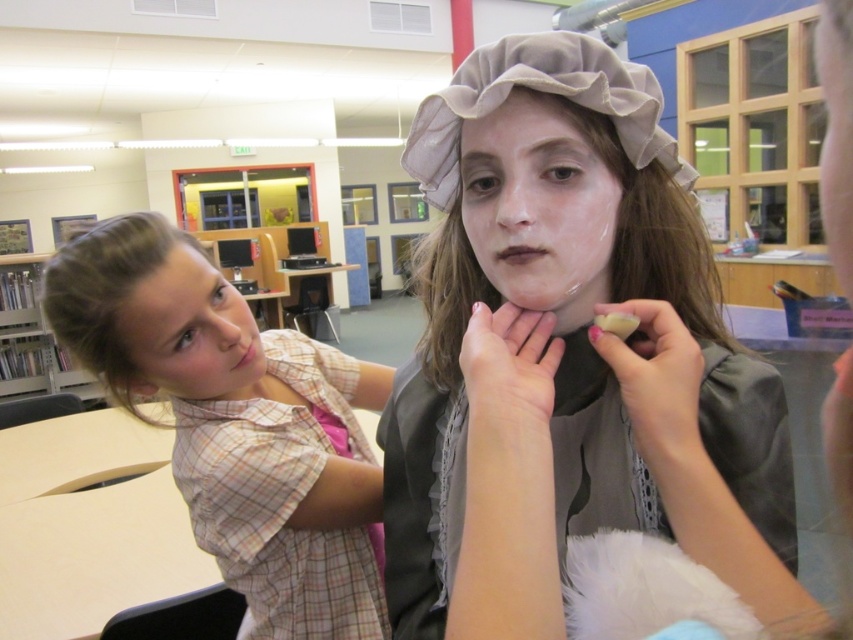
Between matte gray fabric hat at center and wooden bookshelf at left, which one appears on the left side from the viewer's perspective?

From the viewer's perspective, wooden bookshelf at left appears more on the left side.

Can you confirm if matte gray fabric hat at center is wider than wooden bookshelf at left?

In fact, matte gray fabric hat at center might be narrower than wooden bookshelf at left.

Who is more distant from viewer, (x=653, y=195) or (x=68, y=360)?

Point (x=68, y=360)

Locate an element on the screen. This screenshot has width=853, height=640. matte gray fabric hat at center is located at coordinates (561, 305).

Can you confirm if matte gray fabric hat at center is thinner than plaid shirt at center?

Indeed, matte gray fabric hat at center has a lesser width compared to plaid shirt at center.

Can you confirm if matte gray fabric hat at center is positioned above plaid shirt at center?

Yes.

Between point (633, 529) and point (322, 442), which one is positioned in front?

Point (633, 529)

Where is `matte gray fabric hat at center`? The width and height of the screenshot is (853, 640). matte gray fabric hat at center is located at coordinates (561, 305).

Is plaid shirt at center below matte white face at center?

Yes, plaid shirt at center is below matte white face at center.

Between point (252, 436) and point (486, 196), which one is positioned behind?

The point (252, 436) is more distant.

Between point (358, 602) and point (595, 220), which one is positioned behind?

The point (358, 602) is more distant.

Locate an element on the screen. This screenshot has width=853, height=640. plaid shirt at center is located at coordinates (236, 422).